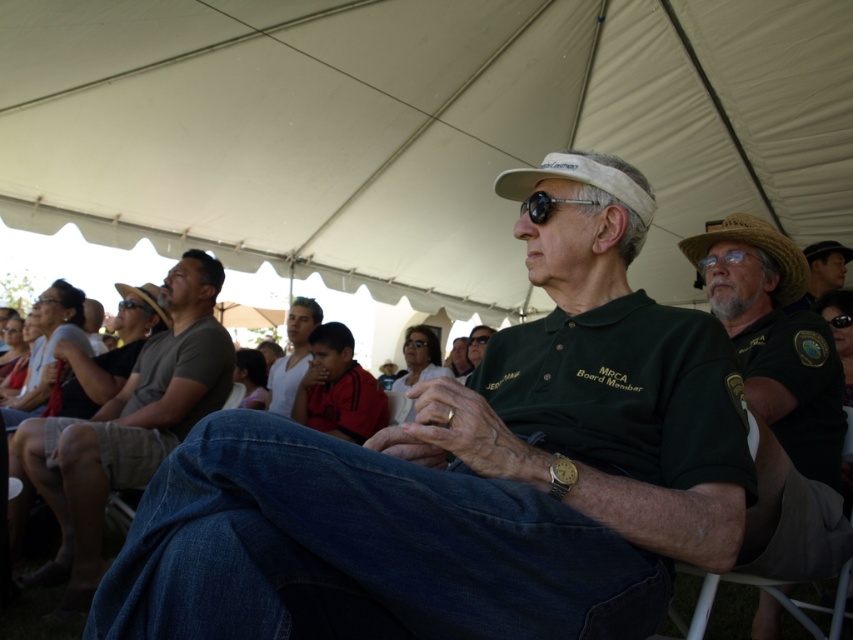
Question: Which of the following is the farthest from the observer?

Choices:
 (A) matte brown hat at upper right
 (B) dark green shirt at center

Answer: (A)

Question: Which object appears closest to the camera in this image?

Choices:
 (A) brown straw cowboy hat at right
 (B) white fabric canopy at upper center
 (C) matte black sunglasses at center

Answer: (A)

Question: Is dark green shirt at center thinner than brown straw cowboy hat at right?

Choices:
 (A) no
 (B) yes

Answer: (A)

Question: Which object appears closest to the camera in this image?

Choices:
 (A) green fabric shirt at center
 (B) white cotton tank top at center
 (C) beige fabric visor at center

Answer: (A)

Question: Does dark green shirt at center appear over black reflective sunglasses at center?

Choices:
 (A) yes
 (B) no

Answer: (B)

Question: From the image, what is the correct spatial relationship of green fabric shirt at center in relation to matte brown hat at upper right?

Choices:
 (A) left
 (B) right

Answer: (A)